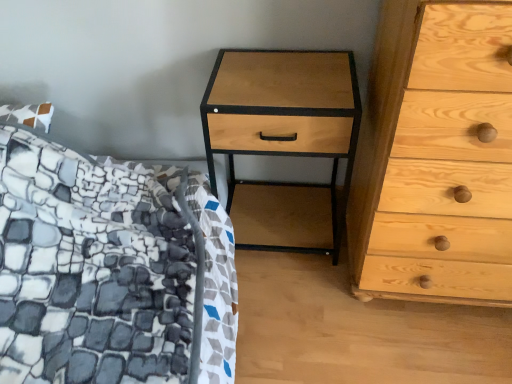
Image resolution: width=512 pixels, height=384 pixels. What do you see at coordinates (283, 117) in the screenshot?
I see `natural wood nightstand at center` at bounding box center [283, 117].

What are the coordinates of `natural wood nightstand at center` in the screenshot? It's located at (283, 117).

I want to click on natural wood chest of drawers at right, so click(x=436, y=158).

The height and width of the screenshot is (384, 512). What do you see at coordinates (436, 158) in the screenshot?
I see `natural wood chest of drawers at right` at bounding box center [436, 158].

The width and height of the screenshot is (512, 384). Find the location of `natural wood nightstand at center`. natural wood nightstand at center is located at coordinates (283, 117).

Consider the image. Between natural wood chest of drawers at right and natural wood nightstand at center, which one appears on the left side from the viewer's perspective?

Positioned to the left is natural wood nightstand at center.

Is natural wood chest of drawers at right in front of or behind natural wood nightstand at center in the image?

Visually, natural wood chest of drawers at right is located in front of natural wood nightstand at center.

Which point is more distant from viewer, (369, 276) or (322, 154)?

Positioned behind is point (322, 154).

From the image's perspective, which one is positioned higher, natural wood chest of drawers at right or natural wood nightstand at center?

natural wood chest of drawers at right, from the image's perspective.

From a real-world perspective, relative to natural wood nightstand at center, is natural wood chest of drawers at right vertically above or below?

From a real-world perspective, natural wood chest of drawers at right is physically above natural wood nightstand at center.

Considering the relative sizes of natural wood chest of drawers at right and natural wood nightstand at center in the image provided, is natural wood chest of drawers at right thinner than natural wood nightstand at center?

No, natural wood chest of drawers at right is not thinner than natural wood nightstand at center.

Which of these two, natural wood chest of drawers at right or natural wood nightstand at center, stands taller?

natural wood chest of drawers at right is taller.

Which of these two, natural wood chest of drawers at right or natural wood nightstand at center, is smaller?

Smaller between the two is natural wood nightstand at center.

Is natural wood chest of drawers at right situated inside natural wood nightstand at center or outside?

natural wood chest of drawers at right is not enclosed by natural wood nightstand at center.

Is natural wood chest of drawers at right placed right next to natural wood nightstand at center?

A: natural wood chest of drawers at right is not next to natural wood nightstand at center, and they're not touching.

Is natural wood chest of drawers at right facing away from natural wood nightstand at center?

natural wood chest of drawers at right does not have its back to natural wood nightstand at center.

Locate an element on the screen. The image size is (512, 384). chest of drawers to the right of natural wood nightstand at center is located at coordinates (436, 158).

Consider the image. Considering the positions of objects natural wood nightstand at center and natural wood chest of drawers at right in the image provided, who is more to the right, natural wood nightstand at center or natural wood chest of drawers at right?

Positioned to the right is natural wood chest of drawers at right.

In the image, is natural wood nightstand at center positioned in front of or behind natural wood chest of drawers at right?

Visually, natural wood nightstand at center is located behind natural wood chest of drawers at right.

Considering the positions of points (228, 104) and (501, 134), is point (228, 104) farther from camera compared to point (501, 134)?

Yes, point (228, 104) is farther from viewer.

From the image's perspective, between natural wood nightstand at center and natural wood chest of drawers at right, who is located below?

natural wood nightstand at center, from the image's perspective.

From a real-world perspective, which is physically below, natural wood nightstand at center or natural wood chest of drawers at right?

natural wood nightstand at center.

Considering the sizes of objects natural wood nightstand at center and natural wood chest of drawers at right in the image provided, who is wider, natural wood nightstand at center or natural wood chest of drawers at right?

natural wood chest of drawers at right is wider.

Is natural wood nightstand at center taller than natural wood chest of drawers at right?

In fact, natural wood nightstand at center may be shorter than natural wood chest of drawers at right.

Considering the sizes of objects natural wood nightstand at center and natural wood chest of drawers at right in the image provided, who is smaller, natural wood nightstand at center or natural wood chest of drawers at right?

natural wood nightstand at center is smaller.

Would you say natural wood chest of drawers at right is part of natural wood nightstand at center's contents?

No, natural wood chest of drawers at right is not a part of natural wood nightstand at center.

Are natural wood nightstand at center and natural wood chest of drawers at right far apart?

No, there isn't a large distance between natural wood nightstand at center and natural wood chest of drawers at right.

Is natural wood chest of drawers at right at the back of natural wood nightstand at center?

That's not correct — natural wood nightstand at center is not looking away from natural wood chest of drawers at right.

In order to click on the chest of drawers that appears above the natural wood nightstand at center (from a real-world perspective) in this screenshot , I will do `click(436, 158)`.

I want to click on the chest of drawers that is above the natural wood nightstand at center (from a real-world perspective), so click(x=436, y=158).

The image size is (512, 384). Identify the location of chest of drawers in front of the natural wood nightstand at center. (436, 158).